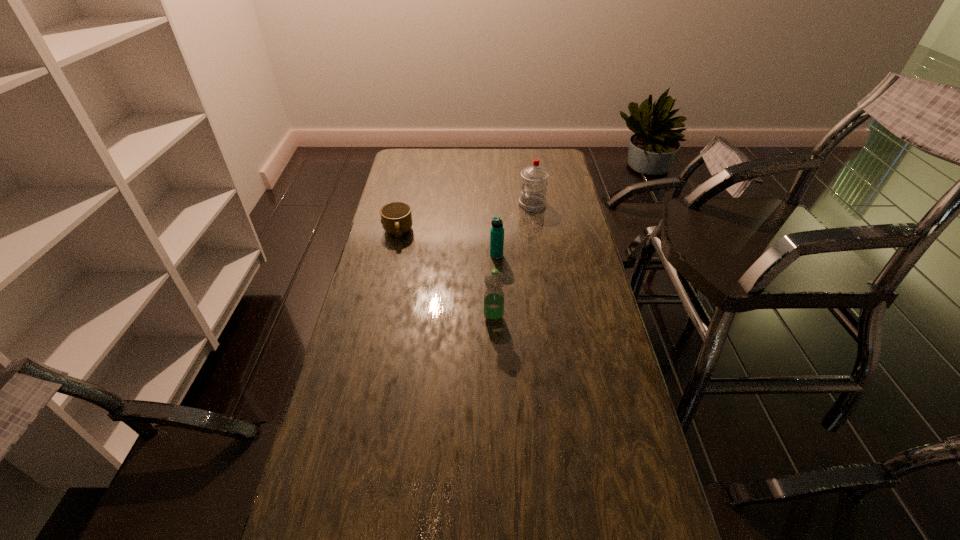
The height and width of the screenshot is (540, 960). Identify the location of object that ranks as the second closest to the nearest object. (396, 218).

The image size is (960, 540). What are the coordinates of `water bottle that is the second closest to the nearest object` in the screenshot? It's located at (534, 178).

Where is `water bottle that can be found as the closest to the third farthest object`? water bottle that can be found as the closest to the third farthest object is located at coordinates tap(494, 280).

Image resolution: width=960 pixels, height=540 pixels. What are the coordinates of `vacant space that satisfies the following two spatial constraints: 1. on the side with the handle of the leftmost object; 2. on the left side of the third farthest object` in the screenshot? It's located at (393, 255).

This screenshot has height=540, width=960. In order to click on free space that satisfies the following two spatial constraints: 1. on the back side of the third farthest object; 2. on the left side of the nearest water bottle in this screenshot , I will do `click(492, 255)`.